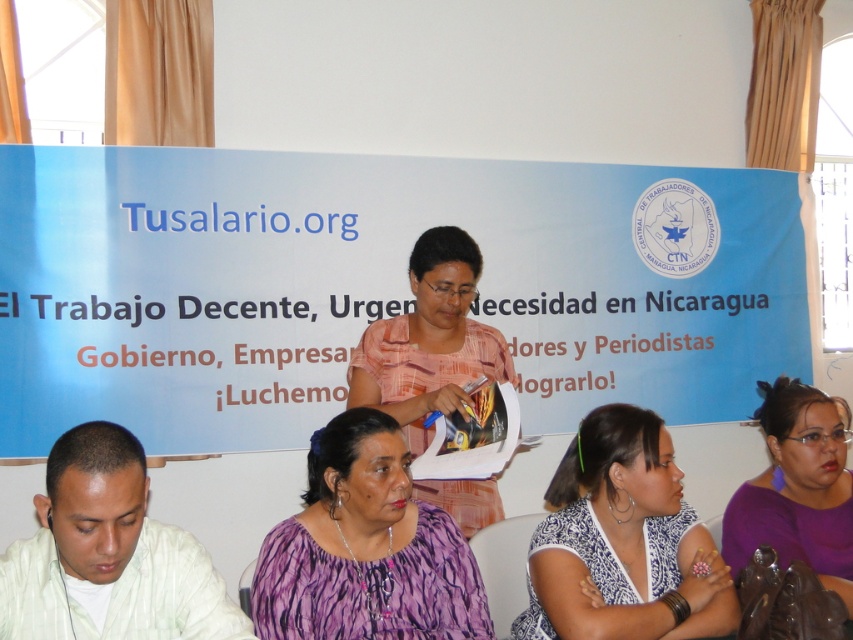
What do you see at coordinates (364, 548) in the screenshot? This screenshot has height=640, width=853. I see `purple woven blouse at center` at bounding box center [364, 548].

Which is behind, point (361, 413) or point (48, 593)?

The point (361, 413) is more distant.

Is point (349, 637) behind point (184, 556)?

Yes, it is.

This screenshot has height=640, width=853. Identify the location of purple woven blouse at center. (364, 548).

Does pink fabric at center have a lesser height compared to purple matte shirt at lower right?

No.

Is point (415, 396) more distant than point (780, 474)?

Yes, it is behind point (780, 474).

What do you see at coordinates (428, 340) in the screenshot? I see `pink fabric at center` at bounding box center [428, 340].

In order to click on pink fabric at center in this screenshot , I will do `click(428, 340)`.

Which is more to the left, blue printed blouse at center or pink fabric at center?

Positioned to the left is pink fabric at center.

At what (x,y) coordinates should I click in order to perform the action: click on blue printed blouse at center. Please return your answer as a coordinate pair (x, y). This screenshot has width=853, height=640. Looking at the image, I should click on (619, 540).

Is point (589, 435) behind point (453, 397)?

No, it is in front of (453, 397).

The height and width of the screenshot is (640, 853). Find the location of `blue printed blouse at center`. blue printed blouse at center is located at coordinates (619, 540).